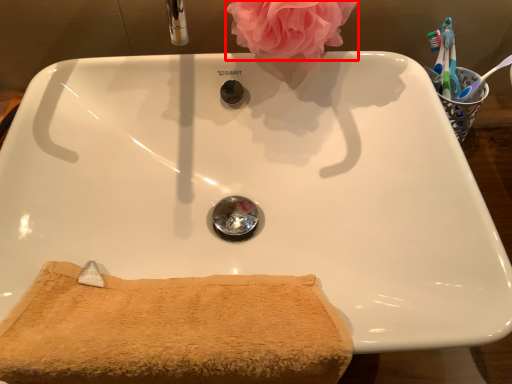
Question: In this image, where is rose (annotated by the red box) located relative to bath towel?

Choices:
 (A) right
 (B) left

Answer: (A)